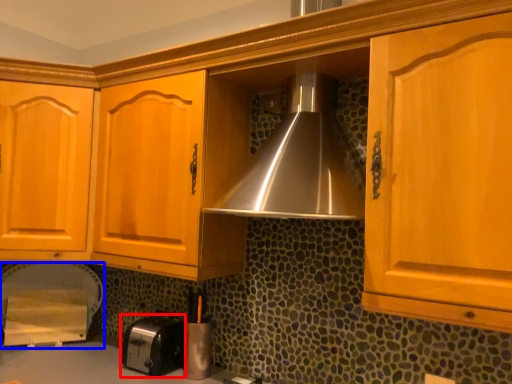
Question: Which object appears closest to the camera in this image, toaster (highlighted by a red box) or appliance (highlighted by a blue box)?

Choices:
 (A) toaster
 (B) appliance

Answer: (A)